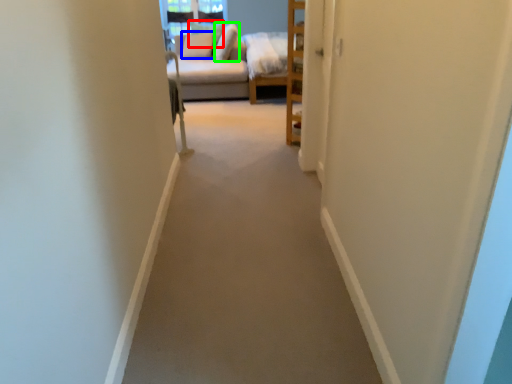
Question: Which object is the farthest from pillow (highlighted by a red box)? Choose among these: pillow (highlighted by a blue box) or pillow (highlighted by a green box).

Choices:
 (A) pillow
 (B) pillow

Answer: (B)